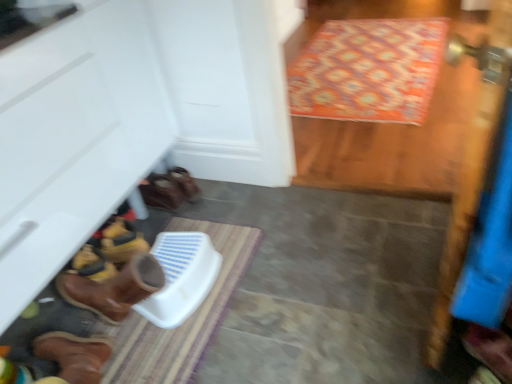
Question: Is patterned fabric doormat at upper right, placed as the second doormat when sorted from bottom to top, spatially inside brown leather boot at lower left, acting as the first footwear starting from the right, or outside of it?

Choices:
 (A) outside
 (B) inside

Answer: (A)

Question: Looking at their shapes, would you say patterned fabric doormat at upper right, placed as the second doormat when sorted from bottom to top, is wider or thinner than brown leather boot at lower left, placed as the second footwear when sorted from left to right?

Choices:
 (A) wide
 (B) thin

Answer: (A)

Question: Which object is the closest to the striped fabric doormat at lower center, which appears as the first doormat when viewed from the left?

Choices:
 (A) brown leather boot at lower left, marked as the second footwear in a front-to-back arrangement
 (B) patterned fabric doormat at upper right, arranged as the first doormat when viewed from the top
 (C) brown leather boot at lower left, the 2th footwear in the top-to-bottom sequence

Answer: (A)

Question: Which object is positioned farthest from the brown leather boot at lower left, which appears as the 2th footwear when viewed from the back?

Choices:
 (A) patterned fabric doormat at upper right, acting as the 1th doormat starting from the right
 (B) brown leather boot at lower left, the 1th footwear positioned from the back
 (C) striped fabric doormat at lower center, the second doormat from the back

Answer: (A)